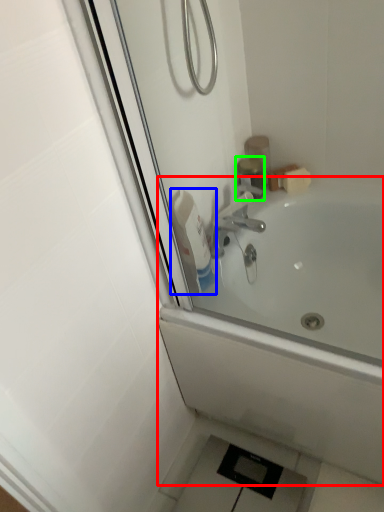
Question: Based on their relative distances, which object is farther from bathtub (highlighted by a red box)? Choose from cleaning product (highlighted by a blue box) and toiletry (highlighted by a green box).

Choices:
 (A) cleaning product
 (B) toiletry

Answer: (B)